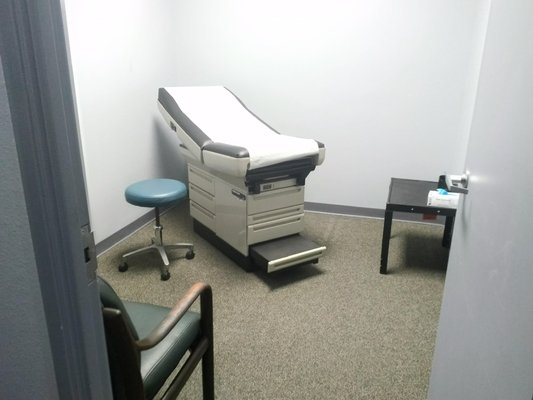
Find the location of `rolling stool`. rolling stool is located at coordinates (158, 228).